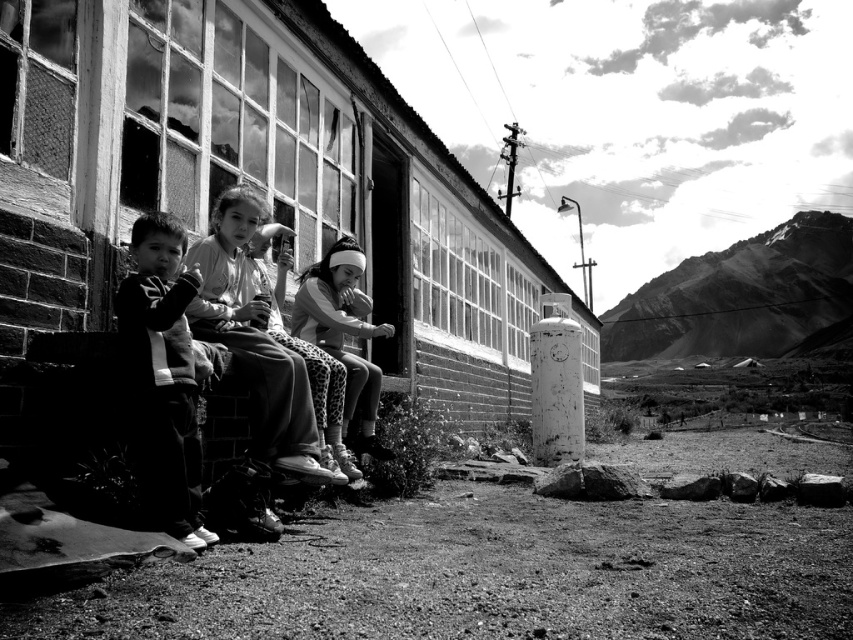
Question: Is dark clothing at left above white fabric headband at center?

Choices:
 (A) yes
 (B) no

Answer: (B)

Question: Is dark clothing at left thinner than white fabric headband at center?

Choices:
 (A) no
 (B) yes

Answer: (B)

Question: Which object appears closest to the camera in this image?

Choices:
 (A) white fabric headband at center
 (B) dark clothing at left

Answer: (B)

Question: Is dark clothing at left closer to the viewer compared to white fabric headband at center?

Choices:
 (A) no
 (B) yes

Answer: (B)